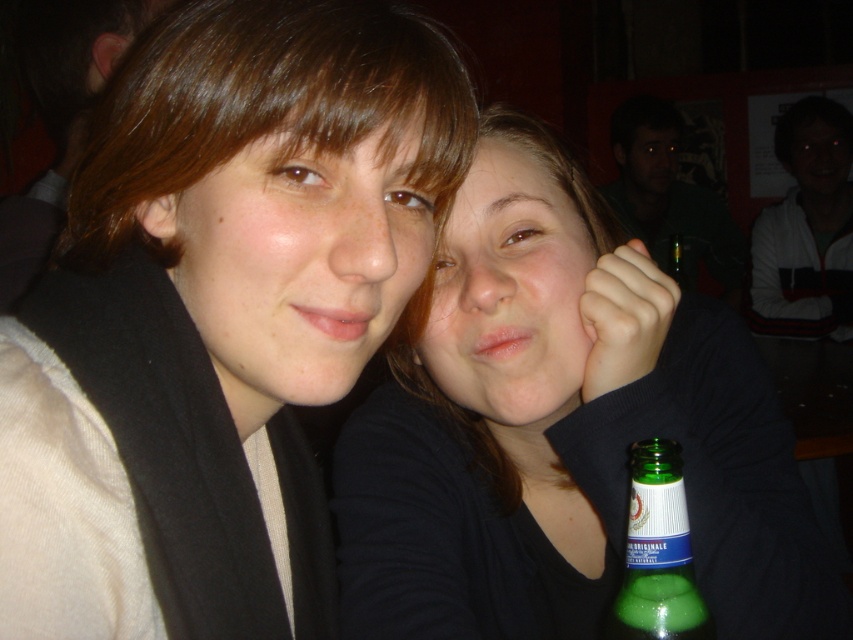
You are a bartender preparing a drink for a customer. You have a green glass bottle at lower center and a matte black shirt at center in your view. Which object is closer to the left side of your workspace?

The matte black shirt at center is to the left of the green glass bottle at lower center, so the matte black shirt at center is closer to the left side of the workspace.

You are a bartender at this bar and need to grab a green glass bottle. You are standing behind the counter and see both the green glass bottle at upper right and the green glass bottle at lower center. Which bottle is closer to you?

The green glass bottle at upper right is closer to you because it is further to the viewer than the green glass bottle at lower center.

You are a bartender at this bar and need to pour a drink using the green glass bottle at upper right and the green glass bottle at lower center. Which bottle should you choose if you want to serve a larger portion?

The green glass bottle at upper right is larger in size than the green glass bottle at lower center, so you should choose the green glass bottle at upper right to serve a larger portion.